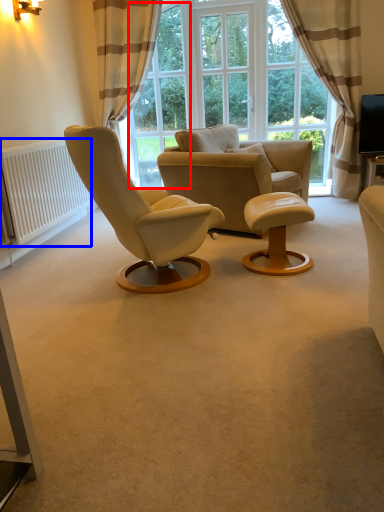
Question: Which object appears farthest to the camera in this image, window screen (highlighted by a red box) or radiator (highlighted by a blue box)?

Choices:
 (A) window screen
 (B) radiator

Answer: (A)